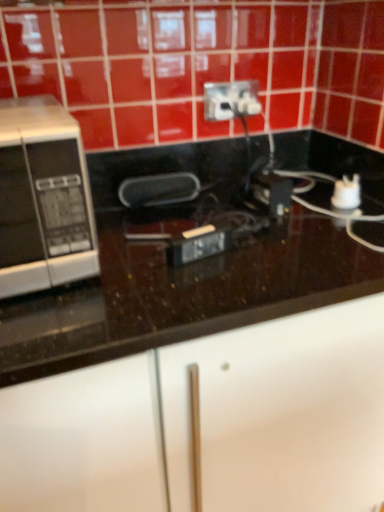
Locate an element on the screen. white plastic power plugs and sockets at upper center is located at coordinates (231, 100).

This screenshot has width=384, height=512. I want to click on silver/black microwave at left, so click(x=43, y=198).

What do you see at coordinates (179, 273) in the screenshot?
I see `black glossy countertop at center` at bounding box center [179, 273].

Locate an element on the screen. The image size is (384, 512). white plastic power plugs and sockets at upper center is located at coordinates (231, 100).

Considering their positions, is black glossy countertop at center located in front of or behind white plastic power plugs and sockets at upper center?

In the image, black glossy countertop at center appears in front of white plastic power plugs and sockets at upper center.

Would you consider black glossy countertop at center to be distant from white plastic power plugs and sockets at upper center?

black glossy countertop at center is actually quite close to white plastic power plugs and sockets at upper center.

Is black glossy countertop at center positioned beyond the bounds of white plastic power plugs and sockets at upper center?

Yes.

Visually, is black glossy countertop at center positioned to the left or to the right of white plastic power plugs and sockets at upper center?

Based on their positions, black glossy countertop at center is located to the left of white plastic power plugs and sockets at upper center.

This screenshot has height=512, width=384. In order to click on countertop on the right of silver/black microwave at left in this screenshot , I will do `click(179, 273)`.

Based on the photo, from the image's perspective, is black glossy countertop at center above or below silver/black microwave at left?

black glossy countertop at center is situated lower than silver/black microwave at left in the image.

Which object is wider, black glossy countertop at center or silver/black microwave at left?

black glossy countertop at center is wider.

Considering the relative sizes of white plastic power plugs and sockets at upper center and black glossy countertop at center in the image provided, is white plastic power plugs and sockets at upper center thinner than black glossy countertop at center?

Indeed, white plastic power plugs and sockets at upper center has a lesser width compared to black glossy countertop at center.

Identify the location of power plugs and sockets above the black glossy countertop at center (from a real-world perspective). Image resolution: width=384 pixels, height=512 pixels. (231, 100).

Considering the relative sizes of white plastic power plugs and sockets at upper center and black glossy countertop at center in the image provided, is white plastic power plugs and sockets at upper center shorter than black glossy countertop at center?

Correct, white plastic power plugs and sockets at upper center is not as tall as black glossy countertop at center.

Can black glossy countertop at center be found inside white plastic power plugs and sockets at upper center?

That's incorrect, black glossy countertop at center is not inside white plastic power plugs and sockets at upper center.

Is silver/black microwave at left positioned behind black glossy countertop at center?

Yes, silver/black microwave at left is behind black glossy countertop at center.

Where is `microwave oven on the left of black glossy countertop at center`? Image resolution: width=384 pixels, height=512 pixels. microwave oven on the left of black glossy countertop at center is located at coordinates (43, 198).

From the image's perspective, is silver/black microwave at left located above or below black glossy countertop at center?

Clearly, from the image's perspective, silver/black microwave at left is above black glossy countertop at center.

Is white plastic power plugs and sockets at upper center facing away from silver/black microwave at left?

No, white plastic power plugs and sockets at upper center's orientation is not away from silver/black microwave at left.

Does white plastic power plugs and sockets at upper center appear on the left side of silver/black microwave at left?

No, white plastic power plugs and sockets at upper center is not to the left of silver/black microwave at left.

Which object is closer to the camera taking this photo, white plastic power plugs and sockets at upper center or silver/black microwave at left?

silver/black microwave at left.

How many degrees apart are the facing directions of white plastic power plugs and sockets at upper center and silver/black microwave at left?

The angular difference between white plastic power plugs and sockets at upper center and silver/black microwave at left is 0.00515 degrees.

From a real-world perspective, between silver/black microwave at left and white plastic power plugs and sockets at upper center, who is vertically lower?

silver/black microwave at left is physically lower.

Can you confirm if silver/black microwave at left is wider than white plastic power plugs and sockets at upper center?

Indeed, silver/black microwave at left has a greater width compared to white plastic power plugs and sockets at upper center.

Is silver/black microwave at left next to white plastic power plugs and sockets at upper center and touching it?

No, silver/black microwave at left is not making contact with white plastic power plugs and sockets at upper center.

Locate an element on the screen. Image resolution: width=384 pixels, height=512 pixels. countertop below the white plastic power plugs and sockets at upper center (from the image's perspective) is located at coordinates (179, 273).

Identify the location of countertop that appears in front of the silver/black microwave at left. (179, 273).

From the image, which object appears to be farther from silver/black microwave at left, white plastic power plugs and sockets at upper center or black glossy countertop at center?

The object further to silver/black microwave at left is white plastic power plugs and sockets at upper center.

Which object lies nearer to the anchor point black glossy countertop at center, white plastic power plugs and sockets at upper center or silver/black microwave at left?

silver/black microwave at left lies closer to black glossy countertop at center than the other object.

In the scene shown: Based on their spatial positions, is silver/black microwave at left or white plastic power plugs and sockets at upper center closer to black glossy countertop at center?

Based on the image, silver/black microwave at left appears to be nearer to black glossy countertop at center.

Based on their spatial positions, is black glossy countertop at center or white plastic power plugs and sockets at upper center closer to silver/black microwave at left?

black glossy countertop at center is positioned closer to the anchor silver/black microwave at left.

Consider the image. Which object lies nearer to the anchor point white plastic power plugs and sockets at upper center, black glossy countertop at center or silver/black microwave at left?

black glossy countertop at center lies closer to white plastic power plugs and sockets at upper center than the other object.

Looking at this image, when comparing their distances from white plastic power plugs and sockets at upper center, does silver/black microwave at left or black glossy countertop at center seem further?

silver/black microwave at left is further to white plastic power plugs and sockets at upper center.

Identify the location of microwave oven between white plastic power plugs and sockets at upper center and black glossy countertop at center from top to bottom. This screenshot has width=384, height=512. (43, 198).